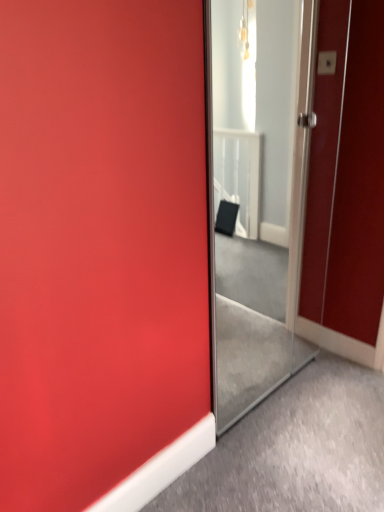
Image resolution: width=384 pixels, height=512 pixels. Describe the element at coordinates (256, 201) in the screenshot. I see `clear glass mirror at center` at that location.

Identify the location of clear glass mirror at center. This screenshot has height=512, width=384. (256, 201).

Identify the location of clear glass mirror at center. This screenshot has width=384, height=512. (256, 201).